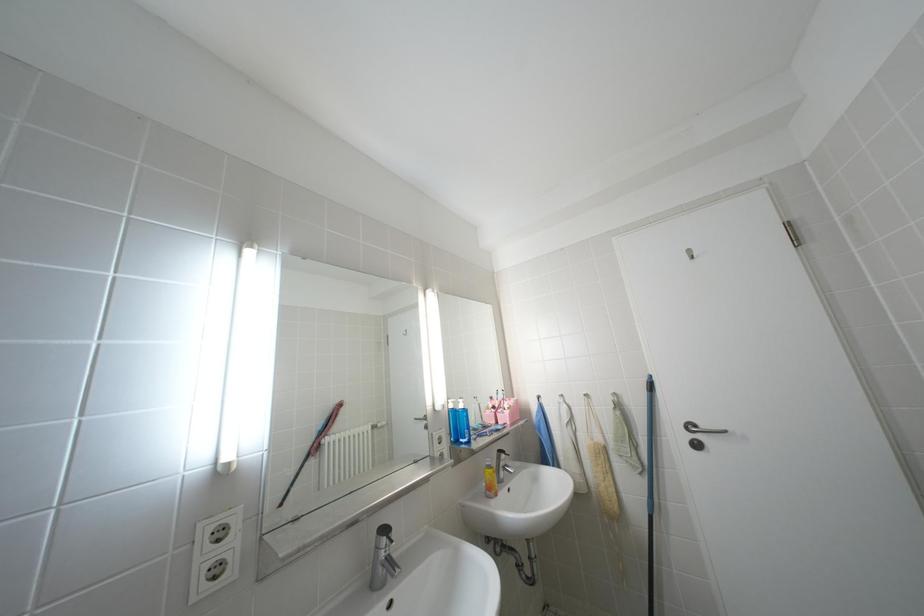
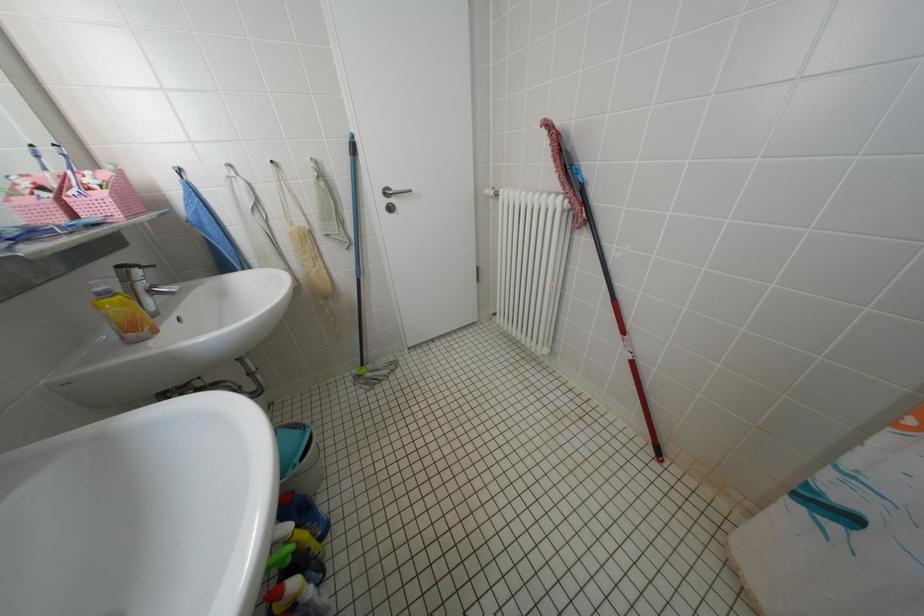
Based on the continuous images, in which direction is the camera rotating?

The camera's rotation is toward right-down.